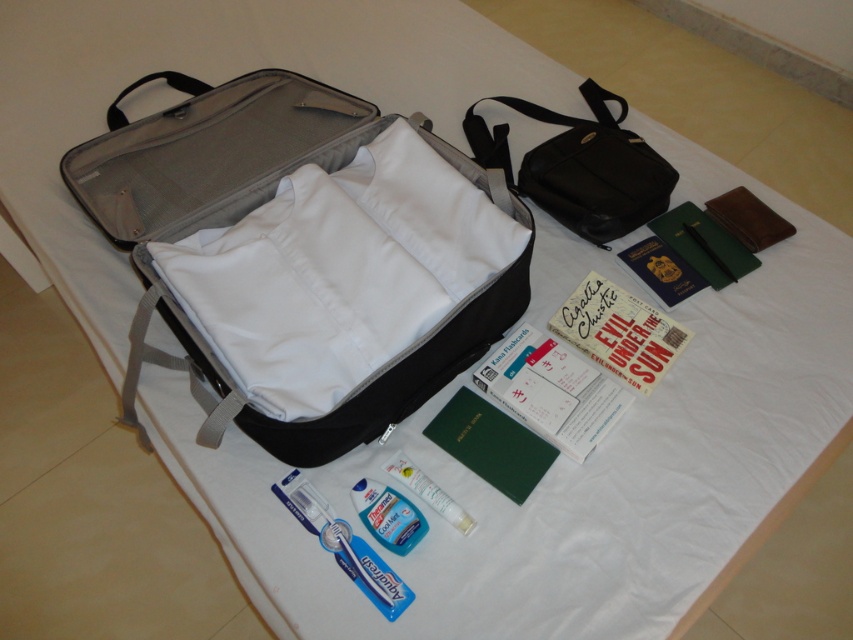
Question: Is matte black suitcase at center positioned in front of blue gel-like container at lower center?

Choices:
 (A) no
 (B) yes

Answer: (B)

Question: Can you confirm if matte black suitcase at center is positioned to the right of translucent plastic tube at center?

Choices:
 (A) yes
 (B) no

Answer: (B)

Question: Does blue gel-like container at lower center have a lesser width compared to translucent plastic tube at center?

Choices:
 (A) no
 (B) yes

Answer: (B)

Question: Which object is farther from the camera taking this photo?

Choices:
 (A) translucent plastic tube at center
 (B) black fabric bag at upper right
 (C) blue glossy toothpaste at lower center

Answer: (B)

Question: Which of the following is the farthest from the observer?

Choices:
 (A) (276, 124)
 (B) (614, 96)

Answer: (B)

Question: Which object is farther from the camera taking this photo?

Choices:
 (A) blue glossy toothpaste at lower center
 (B) translucent plastic tube at center

Answer: (B)